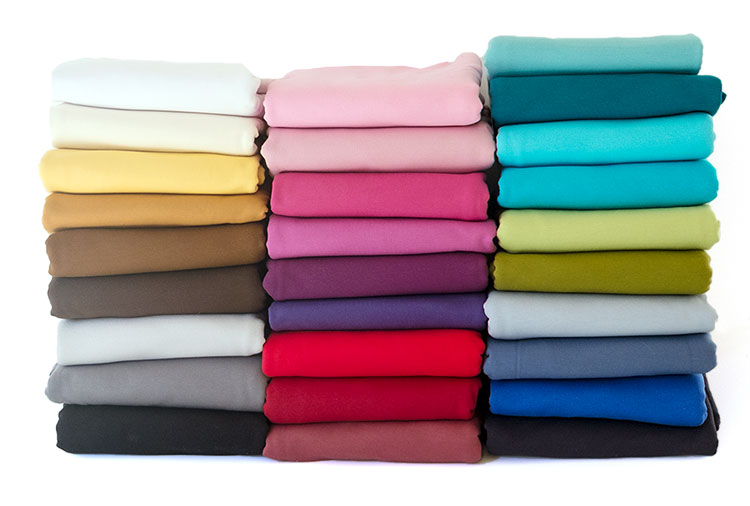
The height and width of the screenshot is (506, 750). I want to click on fabric in left stack, so click(x=200, y=100), click(x=200, y=135), click(x=214, y=178), click(x=223, y=208), click(x=234, y=242), click(x=237, y=284), click(x=232, y=334), click(x=228, y=380), click(x=204, y=428).